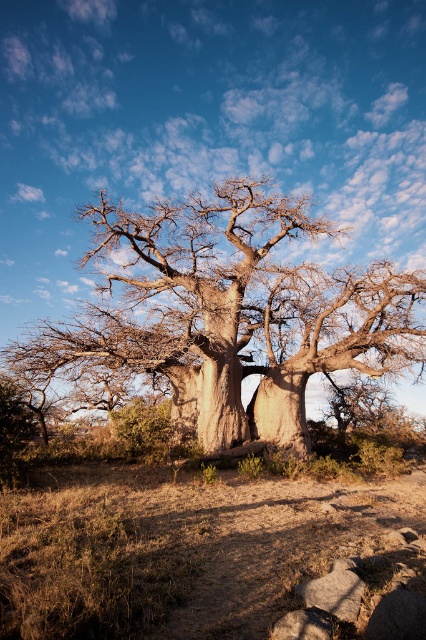
Question: Which point is farther to the camera?

Choices:
 (A) smooth brown tree at center
 (B) brown dry grass at lower center

Answer: (A)

Question: Does brown dry grass at lower center appear on the right side of smooth brown tree at center?

Choices:
 (A) no
 (B) yes

Answer: (B)

Question: Which of the following is the closest to the observer?

Choices:
 (A) (117, 356)
 (B) (14, 637)

Answer: (B)

Question: Is brown dry grass at lower center to the right of smooth brown tree at center from the viewer's perspective?

Choices:
 (A) no
 (B) yes

Answer: (B)

Question: In this image, where is brown dry grass at lower center located relative to smooth brown tree at center?

Choices:
 (A) above
 (B) below

Answer: (B)

Question: Which point appears closest to the camera in this image?

Choices:
 (A) (396, 282)
 (B) (382, 576)

Answer: (B)